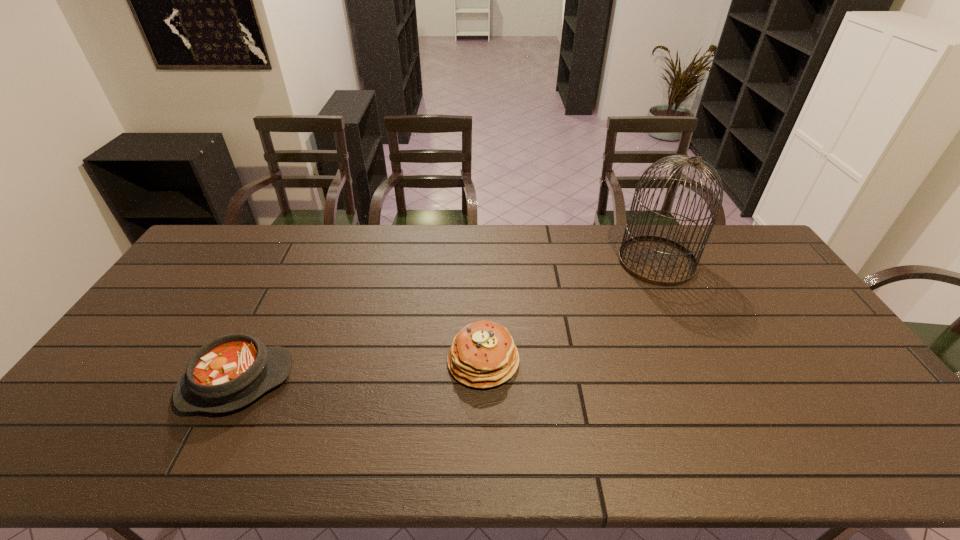
Identify the location of vacant space at the left edge of the desktop. Image resolution: width=960 pixels, height=540 pixels. (180, 302).

Locate an element on the screen. This screenshot has height=540, width=960. free space at the right edge of the desktop is located at coordinates (776, 327).

Find the location of a particular element. free space at the far right corner of the desktop is located at coordinates (725, 238).

The width and height of the screenshot is (960, 540). In the image, there is a desktop. Identify the location of vacant space at the near right corner. (850, 434).

I want to click on free spot between the casserole and the second object from left to right, so click(x=360, y=372).

In order to click on empty space between the leftmost object and the rightmost object in this screenshot , I will do `click(446, 322)`.

The height and width of the screenshot is (540, 960). In order to click on free area in between the farthest object and the casserole in this screenshot , I will do `click(446, 322)`.

Find the location of a particular element. The image size is (960, 540). free point between the casserole and the second object from left to right is located at coordinates (x=360, y=372).

Locate an element on the screen. Image resolution: width=960 pixels, height=540 pixels. vacant region between the tallest object and the pancake is located at coordinates click(x=569, y=311).

Identify the location of free space between the leftmost object and the birdcage. (446, 322).